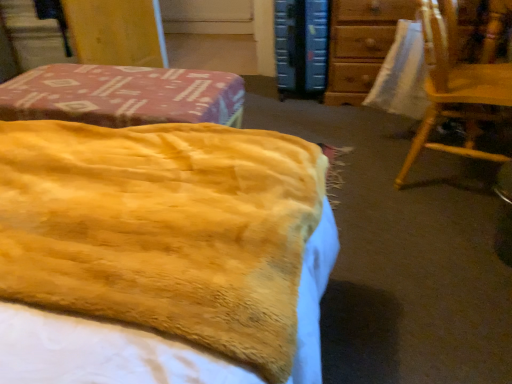
Question: Is wooden chair at upper right surrounded by yellow plush blanket at center?

Choices:
 (A) no
 (B) yes

Answer: (A)

Question: Is yellow plush blanket at center to the right of wooden chair at upper right from the viewer's perspective?

Choices:
 (A) no
 (B) yes

Answer: (A)

Question: Is yellow plush blanket at center bigger than wooden chair at upper right?

Choices:
 (A) no
 (B) yes

Answer: (A)

Question: Is yellow plush blanket at center further to the viewer compared to wooden chair at upper right?

Choices:
 (A) no
 (B) yes

Answer: (A)

Question: From a real-world perspective, does yellow plush blanket at center stand above wooden chair at upper right?

Choices:
 (A) yes
 (B) no

Answer: (A)

Question: Does yellow plush blanket at center have a greater height compared to wooden chair at upper right?

Choices:
 (A) no
 (B) yes

Answer: (A)

Question: Would you consider yellow plush blanket at center to be distant from blue hardcover book at upper center?

Choices:
 (A) yes
 (B) no

Answer: (A)

Question: From the image's perspective, is yellow plush blanket at center above blue hardcover book at upper center?

Choices:
 (A) no
 (B) yes

Answer: (A)

Question: Is yellow plush blanket at center bigger than blue hardcover book at upper center?

Choices:
 (A) no
 (B) yes

Answer: (A)

Question: Does yellow plush blanket at center come in front of blue hardcover book at upper center?

Choices:
 (A) no
 (B) yes

Answer: (B)

Question: Does yellow plush blanket at center have a lesser width compared to blue hardcover book at upper center?

Choices:
 (A) yes
 (B) no

Answer: (B)

Question: Does yellow plush blanket at center come behind blue hardcover book at upper center?

Choices:
 (A) no
 (B) yes

Answer: (A)

Question: Is blue hardcover book at upper center oriented towards yellow plush blanket at center?

Choices:
 (A) yes
 (B) no

Answer: (A)